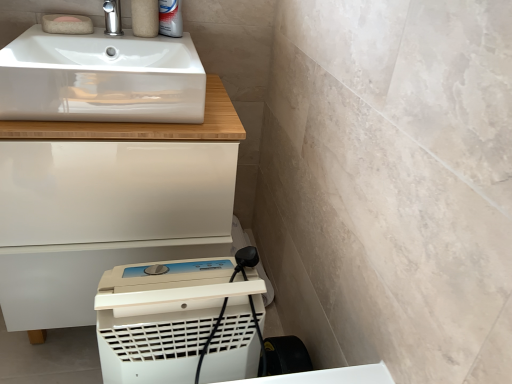
Question: From a real-world perspective, is white plastic dehumidifier at lower center positioned above or below matte beige soap at upper left, the 2th soap positioned from the front?

Choices:
 (A) above
 (B) below

Answer: (B)

Question: Is white plastic dehumidifier at lower center spatially inside matte beige soap at upper left, the 2th soap positioned from the front, or outside of it?

Choices:
 (A) outside
 (B) inside

Answer: (A)

Question: Considering the real-world distances, which object is closest to the white glossy cabinet at lower left?

Choices:
 (A) polished chrome tap at upper left
 (B) matte beige soap at upper left, the 2th soap positioned from the front
 (C) pink felt soap at upper left, placed as the first soap when sorted from front to back
 (D) white plastic dehumidifier at lower center
 (E) white glossy sink at upper left

Answer: (E)

Question: Which is nearer to the white glossy cabinet at lower left?

Choices:
 (A) pink felt soap at upper left, placed as the first soap when sorted from front to back
 (B) matte beige soap at upper left, arranged as the 1th soap when viewed from the back
 (C) white glossy sink at upper left
 (D) white plastic dehumidifier at lower center
 (E) polished chrome tap at upper left

Answer: (C)